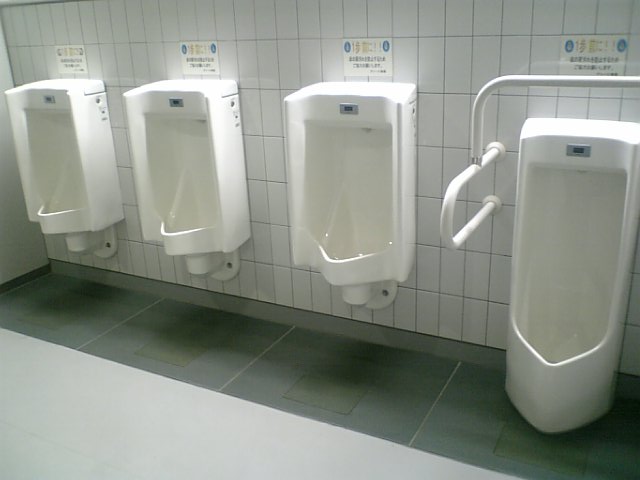
This screenshot has height=480, width=640. What are the coordinates of `signs above the urinals` in the screenshot? It's located at (68, 55), (201, 54), (372, 54), (591, 51).